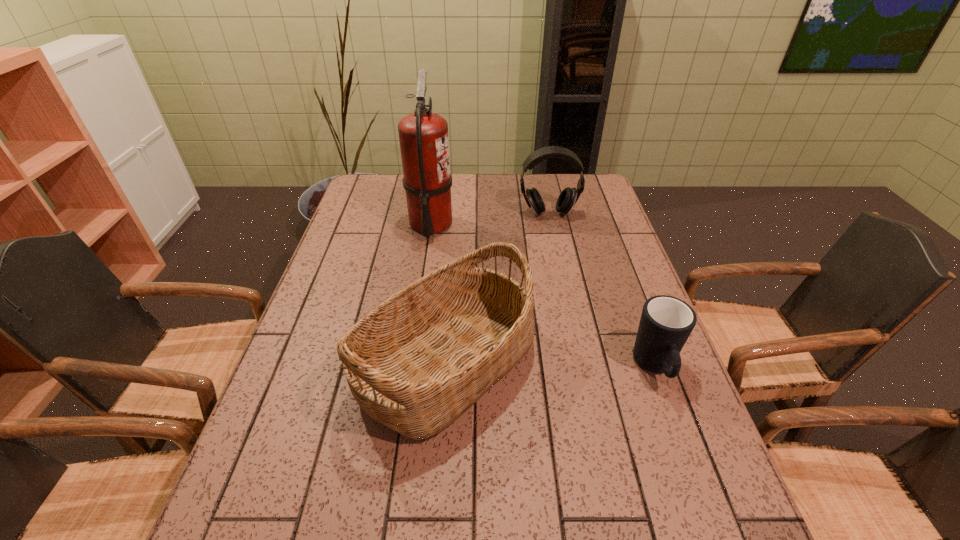
Find the location of a particular element. The height and width of the screenshot is (540, 960). free space between the tallest object and the earphone is located at coordinates (490, 219).

Identify the location of vacant area between the third object from left to right and the mug. (602, 291).

Where is `vacant space in between the basket and the mug`? This screenshot has width=960, height=540. vacant space in between the basket and the mug is located at coordinates (551, 365).

The image size is (960, 540). I want to click on object that stands as the third closest to the fire extinguisher, so click(x=666, y=322).

Find the location of a particular element. The height and width of the screenshot is (540, 960). object that stands as the second closest to the fire extinguisher is located at coordinates (419, 360).

This screenshot has width=960, height=540. I want to click on free region that satisfies the following two spatial constraints: 1. toward the nozzle of the basket; 2. on the right side of the tallest object, so click(x=410, y=362).